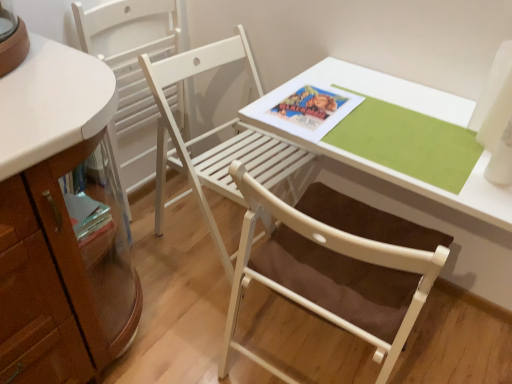
Describe the element at coordinates (417, 180) in the screenshot. I see `white wood table at center` at that location.

This screenshot has width=512, height=384. Identify the location of white wood chair at center, the second chair from the left. (214, 133).

The width and height of the screenshot is (512, 384). In order to click on white wood chair at left, positioned as the 1th chair in left-to-right order in this screenshot , I will do `click(131, 72)`.

Find the location of a particular element. white wood table at center is located at coordinates (417, 180).

Consider the image. Considering the sizes of objects white wood table at center and white wood chair at left, the second chair when ordered from right to left, in the image provided, who is thinner, white wood table at center or white wood chair at left, the second chair when ordered from right to left,?

white wood chair at left, the second chair when ordered from right to left.

Which of these two, white wood table at center or white wood chair at left, the second chair when ordered from right to left, stands taller?

white wood chair at left, the second chair when ordered from right to left, is taller.

Based on their positions, is white wood table at center located to the left or right of white wood chair at left, positioned as the 1th chair in left-to-right order?

Based on their positions, white wood table at center is located to the right of white wood chair at left, positioned as the 1th chair in left-to-right order.

Could you measure the distance between white wood table at center and white wood chair at left, the second chair when ordered from right to left?

white wood table at center is 29.13 inches away from white wood chair at left, the second chair when ordered from right to left.

Which object is more forward, white wood chair at center, the second chair from the left, or white wood chair at left, the second chair when ordered from right to left?

Positioned in front is white wood chair at center, the second chair from the left.

Is white wood chair at center, acting as the first chair starting from the right, completely or partially outside of white wood chair at left, positioned as the 1th chair in left-to-right order?

Yes, white wood chair at center, acting as the first chair starting from the right, is outside of white wood chair at left, positioned as the 1th chair in left-to-right order.

From the image's perspective, is white wood chair at center, acting as the first chair starting from the right, on top of white wood chair at left, positioned as the 1th chair in left-to-right order?

Incorrect, from the image's perspective, white wood chair at center, acting as the first chair starting from the right, is lower than white wood chair at left, positioned as the 1th chair in left-to-right order.

Between white wood chair at center, acting as the first chair starting from the right, and white wood chair at left, the second chair when ordered from right to left, which one has more height?

With more height is white wood chair at left, the second chair when ordered from right to left.

Is white wood chair at left, positioned as the 1th chair in left-to-right order, smaller than white wood chair at center, the second chair from the left?

Correct, white wood chair at left, positioned as the 1th chair in left-to-right order, occupies less space than white wood chair at center, the second chair from the left.

In terms of height, does white wood chair at left, the second chair when ordered from right to left, look taller or shorter compared to white wood chair at center, the second chair from the left?

In the image, white wood chair at left, the second chair when ordered from right to left, appears to be taller than white wood chair at center, the second chair from the left.

Is white wood chair at left, the second chair when ordered from right to left, not inside white wood chair at center, acting as the first chair starting from the right?

white wood chair at left, the second chair when ordered from right to left, lies outside white wood chair at center, acting as the first chair starting from the right,'s area.

Does white wood chair at center, acting as the first chair starting from the right, have a smaller size compared to white wood table at center?

No.

From the image's perspective, who appears lower, white wood chair at center, acting as the first chair starting from the right, or white wood table at center?

white wood table at center, from the image's perspective.

Would you say white wood table at center is part of white wood chair at center, acting as the first chair starting from the right,'s contents?

No, white wood chair at center, acting as the first chair starting from the right, does not contain white wood table at center.

Considering the sizes of objects white wood chair at center, acting as the first chair starting from the right, and white wood table at center in the image provided, who is taller, white wood chair at center, acting as the first chair starting from the right, or white wood table at center?

white wood chair at center, acting as the first chair starting from the right.

How far apart are white wood chair at left, positioned as the 1th chair in left-to-right order, and white wood table at center?

white wood chair at left, positioned as the 1th chair in left-to-right order, is 29.13 inches away from white wood table at center.

Is white wood chair at left, positioned as the 1th chair in left-to-right order, turned away from white wood table at center?

No, white wood chair at left, positioned as the 1th chair in left-to-right order, is not facing away from white wood table at center.

Considering the sizes of white wood chair at left, the second chair when ordered from right to left, and white wood table at center in the image, is white wood chair at left, the second chair when ordered from right to left, bigger or smaller than white wood table at center?

white wood chair at left, the second chair when ordered from right to left, is smaller than white wood table at center.

I want to click on chair that is the 2nd object located behind the white wood table at center, so click(x=131, y=72).

Considering the sizes of white wood table at center and white wood chair at center, acting as the first chair starting from the right, in the image, is white wood table at center wider or thinner than white wood chair at center, acting as the first chair starting from the right,?

white wood table at center is thinner than white wood chair at center, acting as the first chair starting from the right.

You are a GUI agent. You are given a task and a screenshot of the screen. Output one action in this format:
    pyautogui.click(x=<x>, y=<y>)
    Task: Click on the 2nd chair directly beneath the white wood table at center (from a real-world perspective)
    Image resolution: width=512 pixels, height=384 pixels.
    Given the screenshot: What is the action you would take?
    pyautogui.click(x=214, y=133)

Is white wood table at center inside or outside of white wood chair at center, the second chair from the left?

white wood table at center is not enclosed by white wood chair at center, the second chair from the left.

Is the surface of white wood table at center in direct contact with white wood chair at center, acting as the first chair starting from the right?

white wood table at center is not next to white wood chair at center, acting as the first chair starting from the right, and they're not touching.

Locate an element on the screen. Image resolution: width=512 pixels, height=384 pixels. the 1st chair below the white wood table at center (from a real-world perspective) is located at coordinates [x=131, y=72].

At what (x,y) coordinates should I click in order to perform the action: click on chair in front of the white wood chair at left, the second chair when ordered from right to left. Please return your answer as a coordinate pair (x, y). The width and height of the screenshot is (512, 384). Looking at the image, I should click on (214, 133).

Which object lies nearer to the anchor point white wood table at center, white wood chair at center, the second chair from the left, or white wood chair at left, positioned as the 1th chair in left-to-right order?

Based on the image, white wood chair at center, the second chair from the left, appears to be nearer to white wood table at center.

Looking at the image, which one is located closer to white wood chair at center, acting as the first chair starting from the right, white wood table at center or white wood chair at left, positioned as the 1th chair in left-to-right order?

Among the two, white wood chair at left, positioned as the 1th chair in left-to-right order, is located nearer to white wood chair at center, acting as the first chair starting from the right.

Estimate the real-world distances between objects in this image. Which object is further from white wood chair at left, the second chair when ordered from right to left, white wood chair at center, acting as the first chair starting from the right, or white wood table at center?

Based on the image, white wood table at center appears to be further to white wood chair at left, the second chair when ordered from right to left.

Based on their spatial positions, is white wood table at center or white wood chair at center, acting as the first chair starting from the right, further from white wood chair at left, the second chair when ordered from right to left?

white wood table at center is further to white wood chair at left, the second chair when ordered from right to left.

In the scene shown: Based on their spatial positions, is white wood chair at left, positioned as the 1th chair in left-to-right order, or white wood table at center closer to white wood chair at center, the second chair from the left?

The object closer to white wood chair at center, the second chair from the left, is white wood chair at left, positioned as the 1th chair in left-to-right order.

Considering their positions, is white wood chair at left, positioned as the 1th chair in left-to-right order, positioned further to white wood table at center than white wood chair at center, acting as the first chair starting from the right?

Based on the image, white wood chair at left, positioned as the 1th chair in left-to-right order, appears to be further to white wood table at center.

Where is `chair between white wood chair at left, positioned as the 1th chair in left-to-right order, and white wood table at center from left to right`? Image resolution: width=512 pixels, height=384 pixels. chair between white wood chair at left, positioned as the 1th chair in left-to-right order, and white wood table at center from left to right is located at coordinates (214, 133).